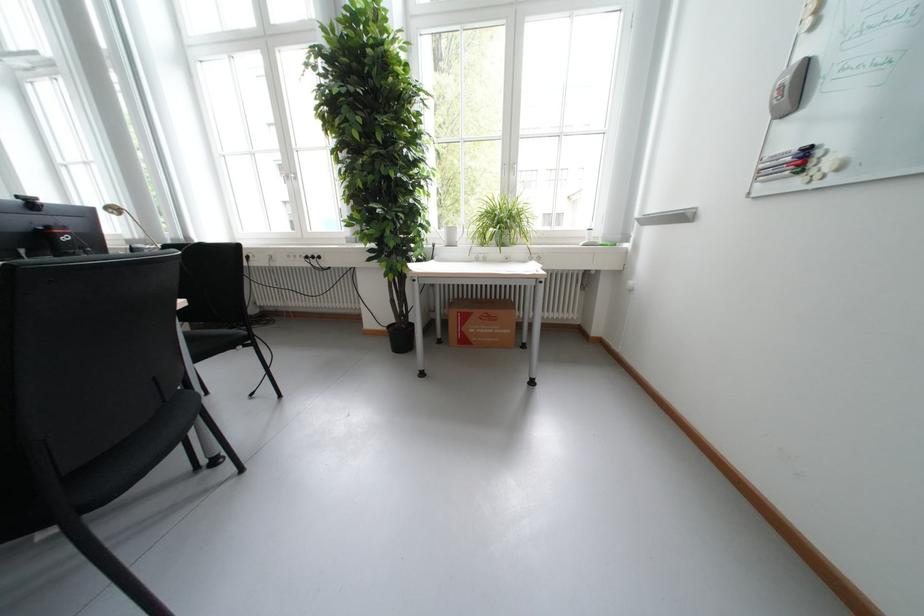
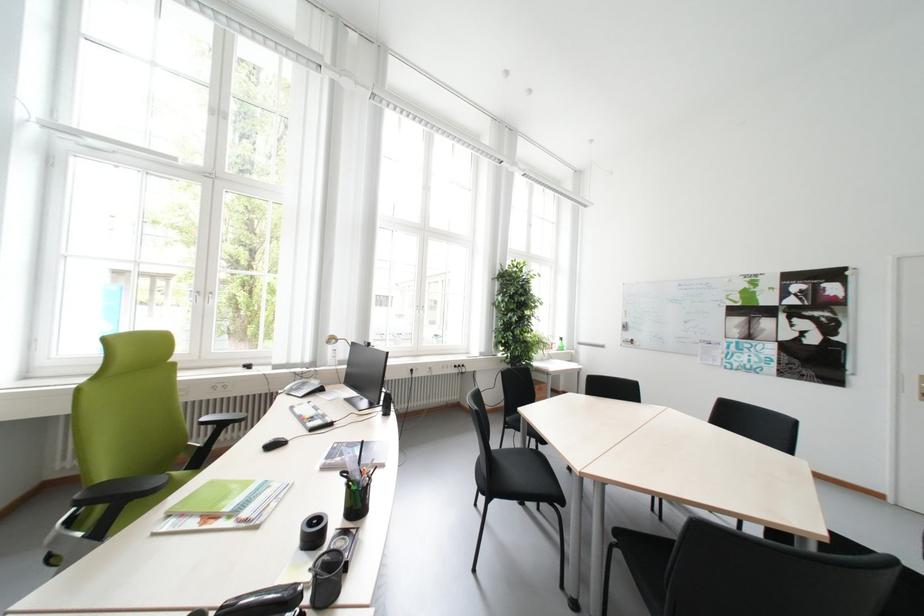
Question: I am providing you with two images of the same scene from different viewpoints. Which of the following objects are not visible in image2?

Choices:
 (A) green chair sitting surface
 (B) red whiteboard marker
 (C) brown cardboard box
 (D) metal door plate

Answer: (C)